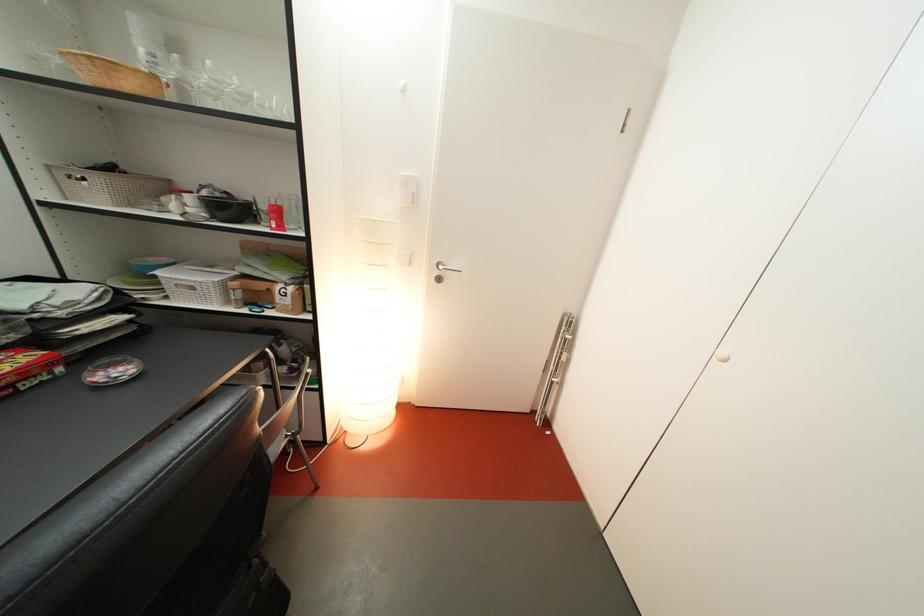
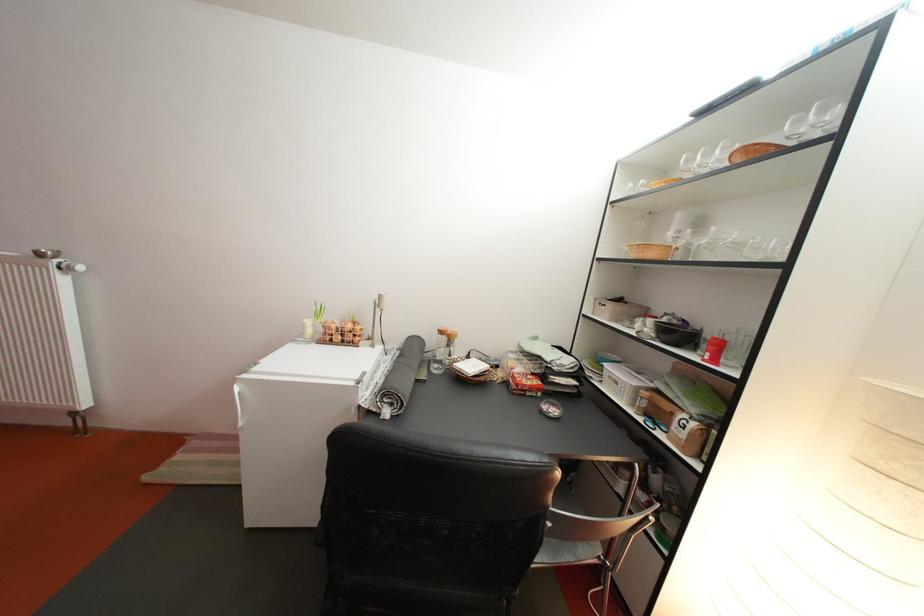
The point at (274, 111) is marked in the first image. Where is the corresponding point in the second image?

(770, 254)